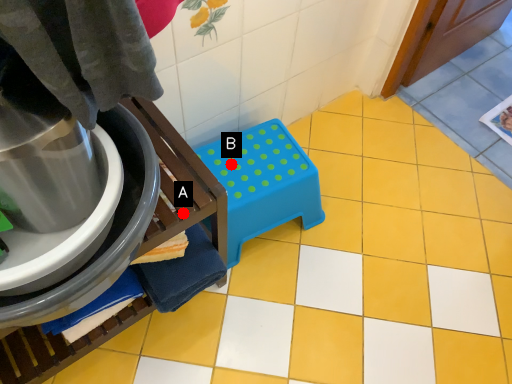
Question: Two points are circled on the image, labeled by A and B beside each circle. Among these points, which one is nearest to the camera?

Choices:
 (A) A is closer
 (B) B is closer

Answer: (A)